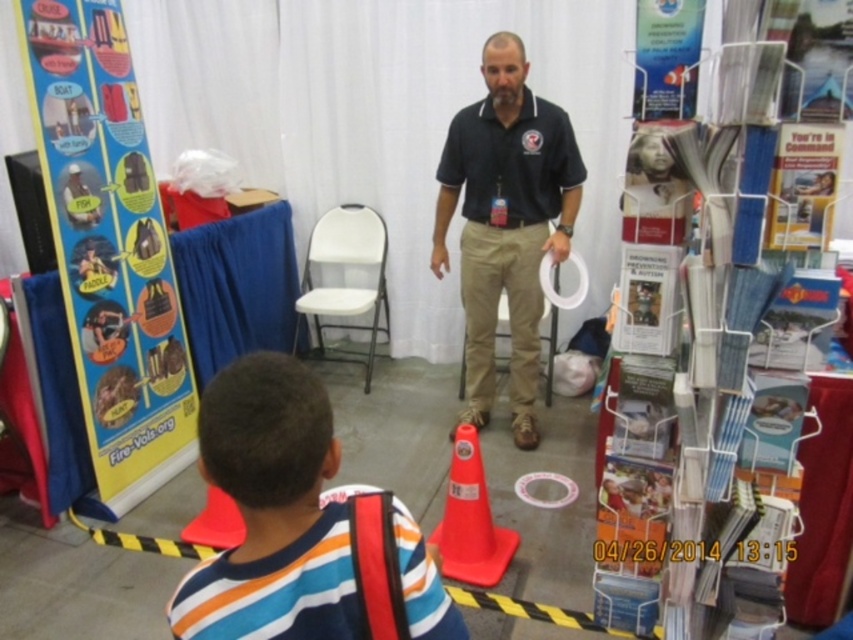
Question: Among these points, which one is farthest from the camera?

Choices:
 (A) (469, 472)
 (B) (439, 193)

Answer: (B)

Question: Observing the image, what is the correct spatial positioning of striped cotton shirt at lower left in reference to rubberized orange cone at center?

Choices:
 (A) above
 (B) below

Answer: (A)

Question: Which point is farther to the camera?

Choices:
 (A) (456, 481)
 (B) (502, 172)
 (C) (277, 452)

Answer: (B)

Question: Which object is farther from the camera taking this photo?

Choices:
 (A) rubberized orange cone at center
 (B) black cotton shirt at center
 (C) striped cotton shirt at lower left

Answer: (B)

Question: Does striped cotton shirt at lower left appear over rubberized orange cone at center?

Choices:
 (A) no
 (B) yes

Answer: (B)

Question: Does striped cotton shirt at lower left appear on the left side of black cotton shirt at center?

Choices:
 (A) yes
 (B) no

Answer: (A)